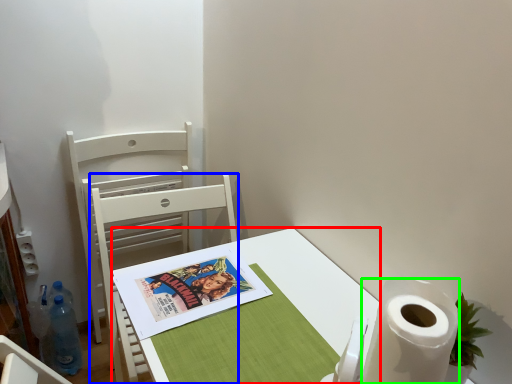
Question: Considering the real-world distances, which object is farthest from desk (highlighted by a red box)? chair (highlighted by a blue box) or paper towel (highlighted by a green box)?

Choices:
 (A) chair
 (B) paper towel

Answer: (A)